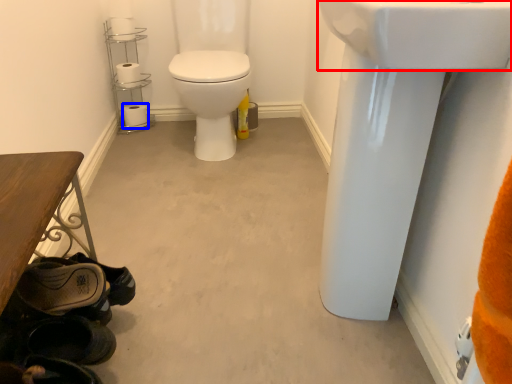
Question: Among these objects, which one is nearest to the camera, sink (highlighted by a red box) or toilet paper (highlighted by a blue box)?

Choices:
 (A) sink
 (B) toilet paper

Answer: (A)